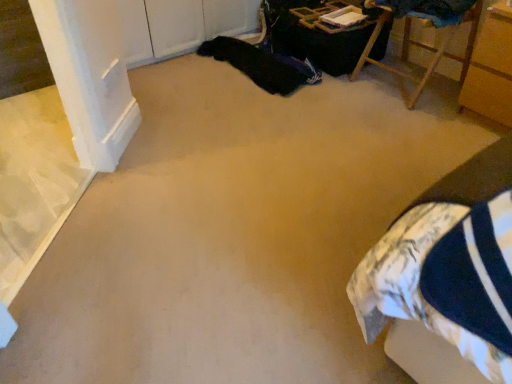
The image size is (512, 384). Find the location of `wooden chair at upper right, the second furniture in the right-to-left sequence`. wooden chair at upper right, the second furniture in the right-to-left sequence is located at coordinates (422, 47).

Between wooden cabinet at right, the 1th furniture in the right-to-left sequence, and wooden chair at upper right, the second furniture in the right-to-left sequence, which one has larger width?

With larger width is wooden cabinet at right, the 1th furniture in the right-to-left sequence.

Are wooden cabinet at right, the 1th furniture in the right-to-left sequence, and wooden chair at upper right, which is the first furniture in left-to-right order, far apart?

No, there isn't a large distance between wooden cabinet at right, the 1th furniture in the right-to-left sequence, and wooden chair at upper right, which is the first furniture in left-to-right order.

Could you tell me if wooden cabinet at right, which is counted as the 2th furniture, starting from the left, is facing wooden chair at upper right, which is the first furniture in left-to-right order?

No, wooden cabinet at right, which is counted as the 2th furniture, starting from the left, is not oriented towards wooden chair at upper right, which is the first furniture in left-to-right order.

Looking at the image, does wooden cabinet at right, which is counted as the 2th furniture, starting from the left, seem bigger or smaller compared to wooden chair at upper right, the second furniture in the right-to-left sequence?

Clearly, wooden cabinet at right, which is counted as the 2th furniture, starting from the left, is smaller in size than wooden chair at upper right, the second furniture in the right-to-left sequence.

From the picture: Considering the sizes of objects black fabric at upper center and wooden chair at upper right, which is the first furniture in left-to-right order, in the image provided, who is bigger, black fabric at upper center or wooden chair at upper right, which is the first furniture in left-to-right order,?

With larger size is wooden chair at upper right, which is the first furniture in left-to-right order.

Is black fabric at upper center inside the boundaries of wooden chair at upper right, the second furniture in the right-to-left sequence, or outside?

black fabric at upper center exists outside the volume of wooden chair at upper right, the second furniture in the right-to-left sequence.

Is black fabric at upper center closer to camera compared to wooden chair at upper right, which is the first furniture in left-to-right order?

No, black fabric at upper center is behind wooden chair at upper right, which is the first furniture in left-to-right order.

From the image's perspective, is black fabric at upper center located above or below wooden chair at upper right, the second furniture in the right-to-left sequence?

black fabric at upper center is situated lower than wooden chair at upper right, the second furniture in the right-to-left sequence, in the image.

From a real-world perspective, between wooden cabinet at right, which is counted as the 2th furniture, starting from the left, and black fabric at upper center, who is vertically higher?

wooden cabinet at right, which is counted as the 2th furniture, starting from the left, from a real-world perspective.

Starting from the black fabric at upper center, which furniture is the 2nd one in front? Please provide its 2D coordinates.

[(490, 69)]

Is wooden cabinet at right, which is counted as the 2th furniture, starting from the left, smaller than black fabric at upper center?

Incorrect, wooden cabinet at right, which is counted as the 2th furniture, starting from the left, is not smaller in size than black fabric at upper center.

Which is in front, point (295, 78) or point (497, 19)?

Positioned in front is point (497, 19).

From the image's perspective, is black fabric at upper center above wooden cabinet at right, which is counted as the 2th furniture, starting from the left?

Yes.

From a real-world perspective, is black fabric at upper center beneath wooden cabinet at right, the 1th furniture in the right-to-left sequence?

Yes.

Is the depth of black fabric at upper center less than that of wooden cabinet at right, which is counted as the 2th furniture, starting from the left?

No, black fabric at upper center is further to the viewer.

Is point (372, 63) behind point (231, 63)?

No, (372, 63) is in front of (231, 63).

Considering the sizes of objects wooden chair at upper right, the second furniture in the right-to-left sequence, and black fabric at upper center in the image provided, who is taller, wooden chair at upper right, the second furniture in the right-to-left sequence, or black fabric at upper center?

wooden chair at upper right, the second furniture in the right-to-left sequence, is taller.

From a real-world perspective, is wooden chair at upper right, the second furniture in the right-to-left sequence, under black fabric at upper center?

Actually, wooden chair at upper right, the second furniture in the right-to-left sequence, is physically above black fabric at upper center in the real world.

Is wooden chair at upper right, the second furniture in the right-to-left sequence, aimed at black fabric at upper center?

No, wooden chair at upper right, the second furniture in the right-to-left sequence, is not aimed at black fabric at upper center.

Does wooden chair at upper right, which is the first furniture in left-to-right order, have a greater height compared to wooden cabinet at right, the 1th furniture in the right-to-left sequence?

In fact, wooden chair at upper right, which is the first furniture in left-to-right order, may be shorter than wooden cabinet at right, the 1th furniture in the right-to-left sequence.

Is point (424, 78) more distant than point (477, 104)?

That is True.

Can you tell me how much wooden chair at upper right, the second furniture in the right-to-left sequence, and wooden cabinet at right, the 1th furniture in the right-to-left sequence, differ in facing direction?

2.02 degrees.

Find the location of `furniture that is in front of the wooden chair at upper right, the second furniture in the right-to-left sequence`. furniture that is in front of the wooden chair at upper right, the second furniture in the right-to-left sequence is located at coordinates (490, 69).

Where is `furniture that is above the black fabric at upper center (from the image's perspective)`? This screenshot has height=384, width=512. furniture that is above the black fabric at upper center (from the image's perspective) is located at coordinates (422, 47).

From the image, which object appears to be farther from wooden cabinet at right, which is counted as the 2th furniture, starting from the left, wooden chair at upper right, which is the first furniture in left-to-right order, or black fabric at upper center?

Among the two, black fabric at upper center is located further to wooden cabinet at right, which is counted as the 2th furniture, starting from the left.

Looking at the image, which one is located closer to wooden chair at upper right, the second furniture in the right-to-left sequence, black fabric at upper center or wooden cabinet at right, which is counted as the 2th furniture, starting from the left?

Among the two, wooden cabinet at right, which is counted as the 2th furniture, starting from the left, is located nearer to wooden chair at upper right, the second furniture in the right-to-left sequence.

When comparing their distances from black fabric at upper center, does wooden chair at upper right, which is the first furniture in left-to-right order, or wooden cabinet at right, the 1th furniture in the right-to-left sequence, seem further?

wooden cabinet at right, the 1th furniture in the right-to-left sequence.

Estimate the real-world distances between objects in this image. Which object is further from wooden cabinet at right, which is counted as the 2th furniture, starting from the left, black fabric at upper center or wooden chair at upper right, the second furniture in the right-to-left sequence?

black fabric at upper center is further to wooden cabinet at right, which is counted as the 2th furniture, starting from the left.

Looking at the image, which one is located further to black fabric at upper center, wooden cabinet at right, which is counted as the 2th furniture, starting from the left, or wooden chair at upper right, which is the first furniture in left-to-right order?

Among the two, wooden cabinet at right, which is counted as the 2th furniture, starting from the left, is located further to black fabric at upper center.

Considering their positions, is wooden cabinet at right, the 1th furniture in the right-to-left sequence, positioned further to wooden chair at upper right, which is the first furniture in left-to-right order, than black fabric at upper center?

black fabric at upper center lies further to wooden chair at upper right, which is the first furniture in left-to-right order, than the other object.

Find the location of a particular element. Image resolution: width=512 pixels, height=384 pixels. furniture between black fabric at upper center and wooden cabinet at right, the 1th furniture in the right-to-left sequence, in the horizontal direction is located at coordinates (422, 47).